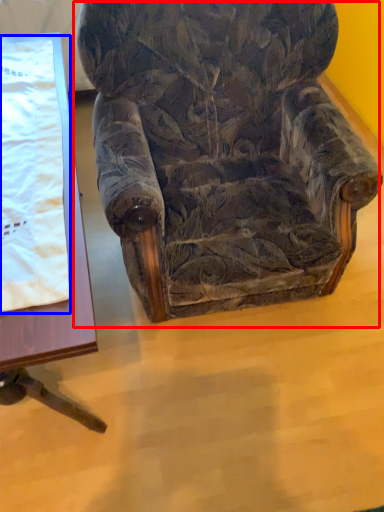
Question: Which object appears farthest to the camera in this image, chair (highlighted by a red box) or blanket (highlighted by a blue box)?

Choices:
 (A) chair
 (B) blanket

Answer: (B)